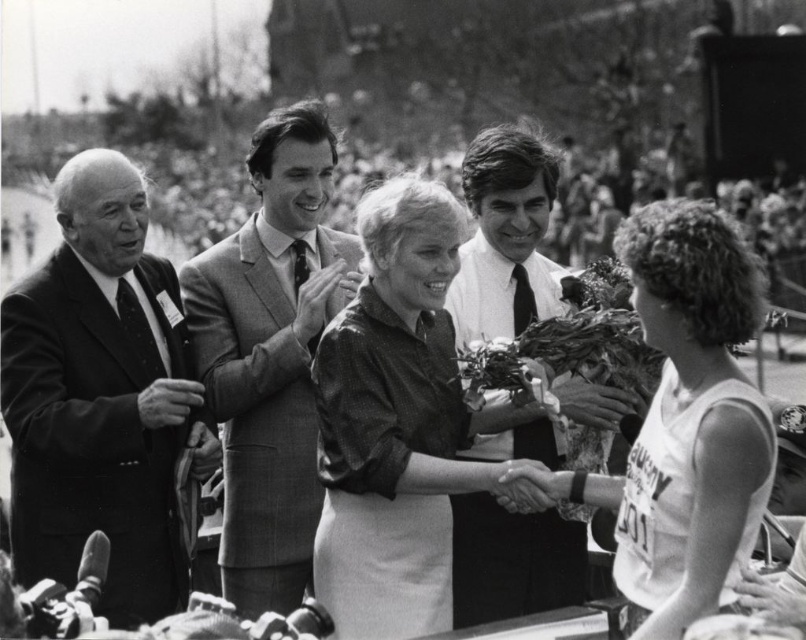
Question: Estimate the real-world distances between objects in this image. Which object is farther from the white shirt at center?

Choices:
 (A) smooth suit at center
 (B) shiny dark brown dress at center
 (C) smooth suit at left

Answer: (C)

Question: In this image, where is shiny dark brown dress at center located relative to white jersey at center?

Choices:
 (A) right
 (B) left

Answer: (B)

Question: Among these objects, which one is nearest to the camera?

Choices:
 (A) shiny dark brown dress at center
 (B) smooth suit at left
 (C) white shirt at center
 (D) smooth skin hand at center

Answer: (D)

Question: Does shiny dark brown dress at center have a greater width compared to white shirt at center?

Choices:
 (A) yes
 (B) no

Answer: (A)

Question: Can you confirm if smooth suit at left is smaller than smooth suit at center?

Choices:
 (A) no
 (B) yes

Answer: (B)

Question: Which of the following is the closest to the observer?

Choices:
 (A) smooth suit at left
 (B) white shirt at center
 (C) shiny dark brown dress at center
 (D) white jersey at center

Answer: (D)